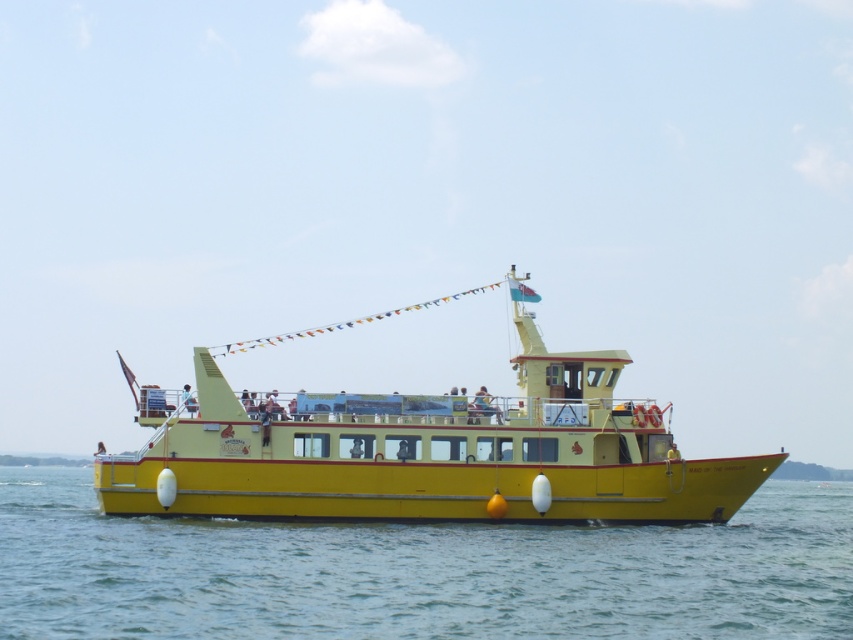
Who is higher up, yellow matte water at lower center or yellow matte boat at center?

yellow matte boat at center is above.

Where is `yellow matte water at lower center`? yellow matte water at lower center is located at coordinates (418, 572).

Locate an element on the screen. yellow matte water at lower center is located at coordinates (418, 572).